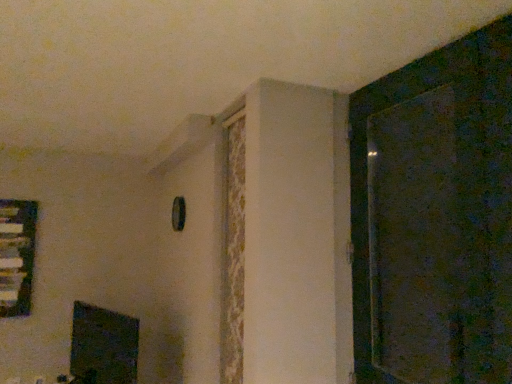
Question: Is clear glass window at left positioned beyond the bounds of black glossy fireplace at lower left?

Choices:
 (A) yes
 (B) no

Answer: (A)

Question: Is clear glass window at left at the right side of black glossy fireplace at lower left?

Choices:
 (A) no
 (B) yes

Answer: (A)

Question: Is clear glass window at left smaller than black glossy fireplace at lower left?

Choices:
 (A) yes
 (B) no

Answer: (A)

Question: Is the position of clear glass window at left more distant than that of black glossy fireplace at lower left?

Choices:
 (A) no
 (B) yes

Answer: (B)

Question: Is clear glass window at left turned away from black glossy fireplace at lower left?

Choices:
 (A) yes
 (B) no

Answer: (B)

Question: Does clear glass window at left have a lesser height compared to black glossy fireplace at lower left?

Choices:
 (A) yes
 (B) no

Answer: (B)

Question: Is black glossy fireplace at lower left turned away from dark textured screen door at right?

Choices:
 (A) no
 (B) yes

Answer: (A)

Question: Considering the relative positions of black glossy fireplace at lower left and dark textured screen door at right in the image provided, is black glossy fireplace at lower left behind dark textured screen door at right?

Choices:
 (A) yes
 (B) no

Answer: (A)

Question: From a real-world perspective, is black glossy fireplace at lower left beneath dark textured screen door at right?

Choices:
 (A) yes
 (B) no

Answer: (A)

Question: Considering the relative positions of black glossy fireplace at lower left and dark textured screen door at right in the image provided, is black glossy fireplace at lower left in front of dark textured screen door at right?

Choices:
 (A) no
 (B) yes

Answer: (A)

Question: From the image's perspective, is black glossy fireplace at lower left located beneath dark textured screen door at right?

Choices:
 (A) no
 (B) yes

Answer: (B)

Question: Is black glossy fireplace at lower left positioned beyond the bounds of dark textured screen door at right?

Choices:
 (A) yes
 (B) no

Answer: (A)

Question: Is dark textured screen door at right closer to the viewer compared to black glossy fireplace at lower left?

Choices:
 (A) yes
 (B) no

Answer: (A)